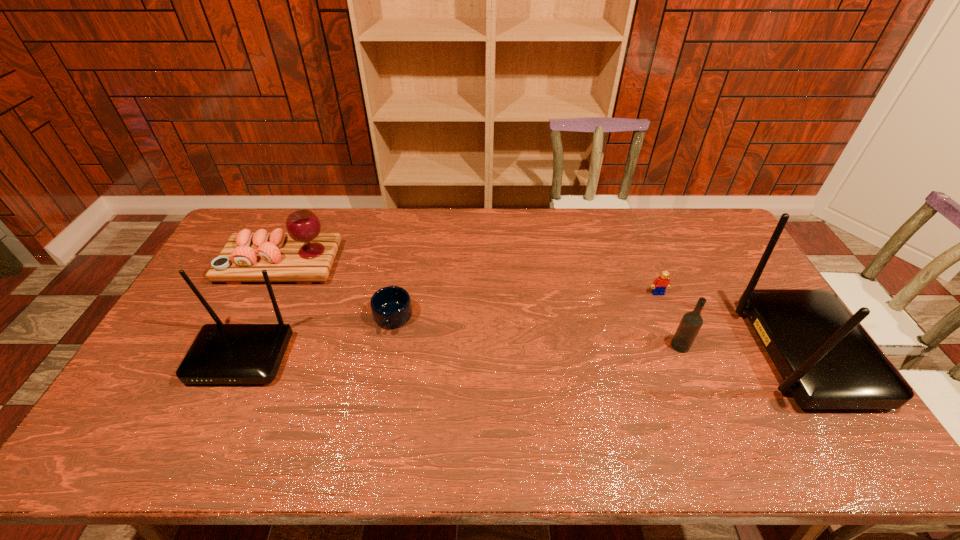
Please mark a free spot for a new router_(computer_equipment) to balance the arrangement. Please provide its 2D coordinates. Your answer should be formatted as a tuple, i.e. [(x, y)], where the tuple contains the x and y coordinates of a point satisfying the conditions above.

[(524, 355)]